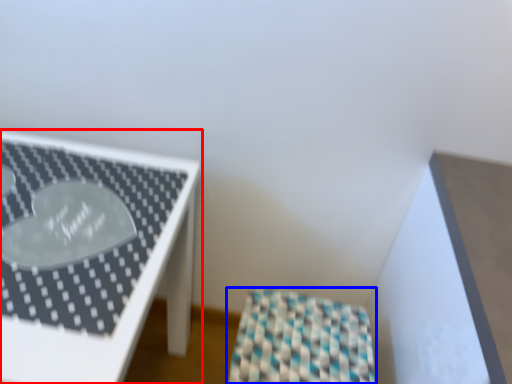
Question: Which object is closer to the camera taking this photo, furniture (highlighted by a red box) or furniture (highlighted by a blue box)?

Choices:
 (A) furniture
 (B) furniture

Answer: (A)